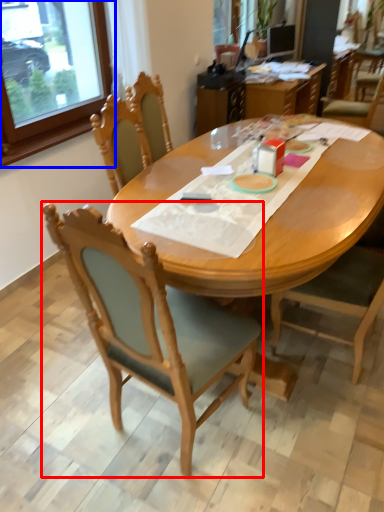
Question: Among these objects, which one is nearest to the camera, chair (highlighted by a red box) or window frame (highlighted by a blue box)?

Choices:
 (A) chair
 (B) window frame

Answer: (A)